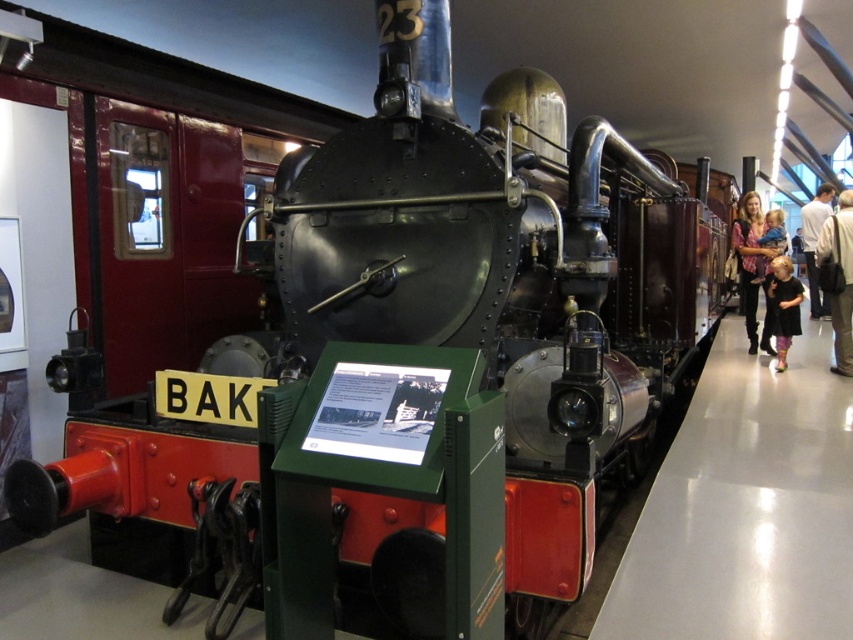
Question: Can you confirm if dark brown leather jacket at right is positioned below light brown leather jacket at right?

Choices:
 (A) no
 (B) yes

Answer: (B)

Question: Which object appears farthest from the camera in this image?

Choices:
 (A) light brown leather jacket at right
 (B) black dress at lower right
 (C) light pink fabric at right
 (D) dark brown leather jacket at right

Answer: (A)

Question: Observing the image, what is the correct spatial positioning of black dress at lower right in reference to light pink fabric at right?

Choices:
 (A) above
 (B) below

Answer: (B)

Question: Estimate the real-world distances between objects in this image. Which object is closer to the black dress at lower right?

Choices:
 (A) light pink fabric at right
 (B) dark brown leather jacket at right

Answer: (A)

Question: Is black dress at lower right to the left of light brown leather jacket at right from the viewer's perspective?

Choices:
 (A) yes
 (B) no

Answer: (A)

Question: Which point is closer to the camera?

Choices:
 (A) black dress at lower right
 (B) light pink fabric at right

Answer: (A)